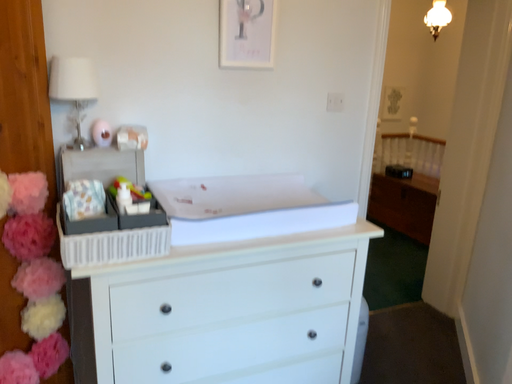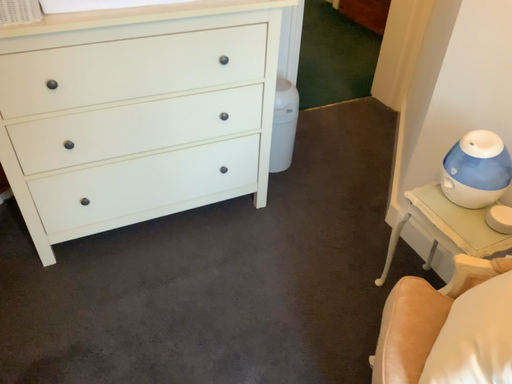
Question: Which way did the camera rotate in the video?

Choices:
 (A) rotated downward
 (B) rotated upward

Answer: (A)